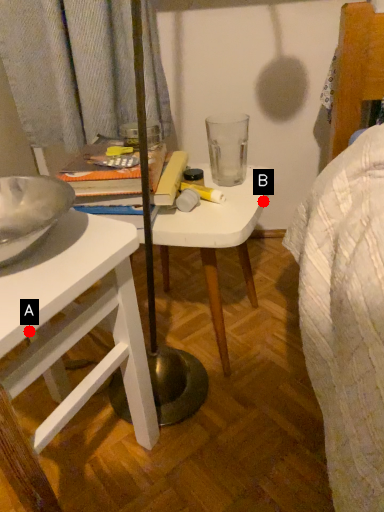
Question: Two points are circled on the image, labeled by A and B beside each circle. Which point is closer to the camera?

Choices:
 (A) A is closer
 (B) B is closer

Answer: (A)